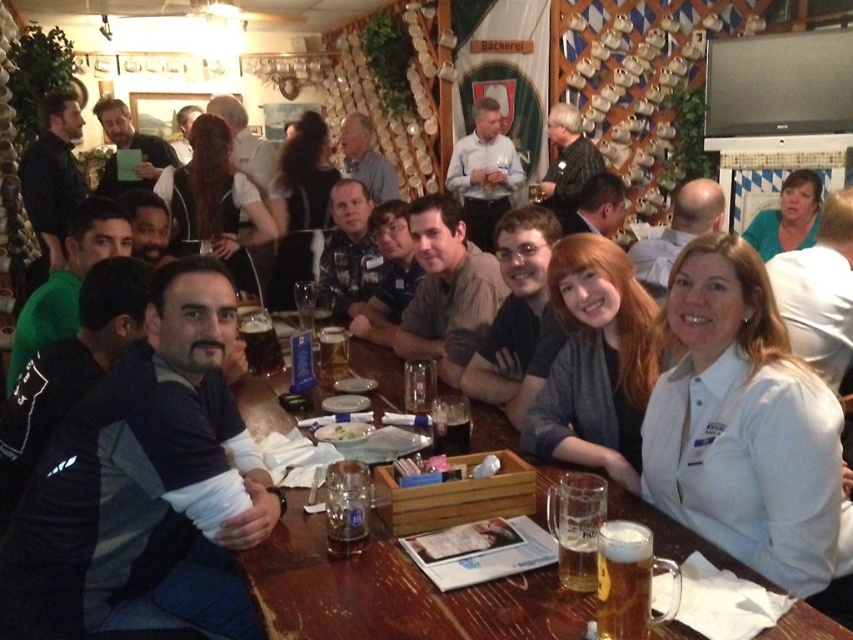
Question: Does black leather jacket at upper left have a larger size compared to translucent glass beer at center?

Choices:
 (A) no
 (B) yes

Answer: (B)

Question: Is wooden table at center below translucent glass beer at center?

Choices:
 (A) no
 (B) yes

Answer: (B)

Question: Which point is closer to the camera?

Choices:
 (A) (727, 483)
 (B) (773, 253)
 (C) (788, 612)

Answer: (C)

Question: Which object appears closest to the camera in this image?

Choices:
 (A) green matte shirt at upper right
 (B) white matte shirt at lower right

Answer: (B)

Question: In this image, where is black leather jacket at upper left located relative to translucent glass beer at center?

Choices:
 (A) above
 (B) below

Answer: (A)

Question: Which of the following is the closest to the observer?

Choices:
 (A) (622, 394)
 (B) (177, 488)
 (C) (328, 336)

Answer: (B)